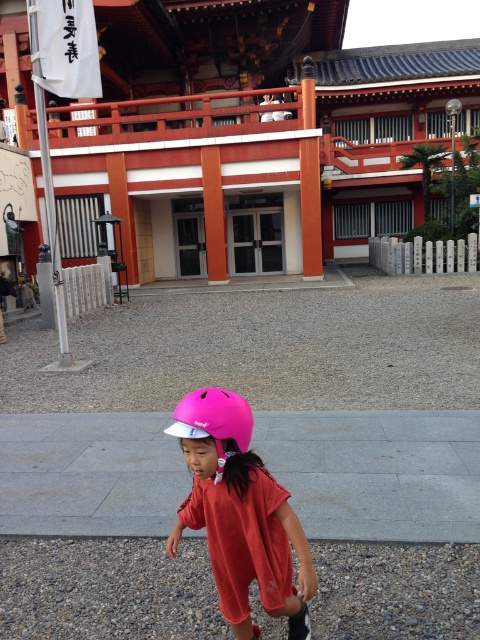
Question: Which point is closer to the camera taking this photo?

Choices:
 (A) (208, 440)
 (B) (230, 452)

Answer: (A)

Question: From the image, what is the correct spatial relationship of pink matte helmet at center in relation to pink matte helmet at lower center?

Choices:
 (A) above
 (B) below

Answer: (B)

Question: Observing the image, what is the correct spatial positioning of pink matte helmet at center in reference to pink matte helmet at lower center?

Choices:
 (A) left
 (B) right

Answer: (B)

Question: Is pink matte helmet at center further to the viewer compared to pink matte helmet at lower center?

Choices:
 (A) yes
 (B) no

Answer: (B)